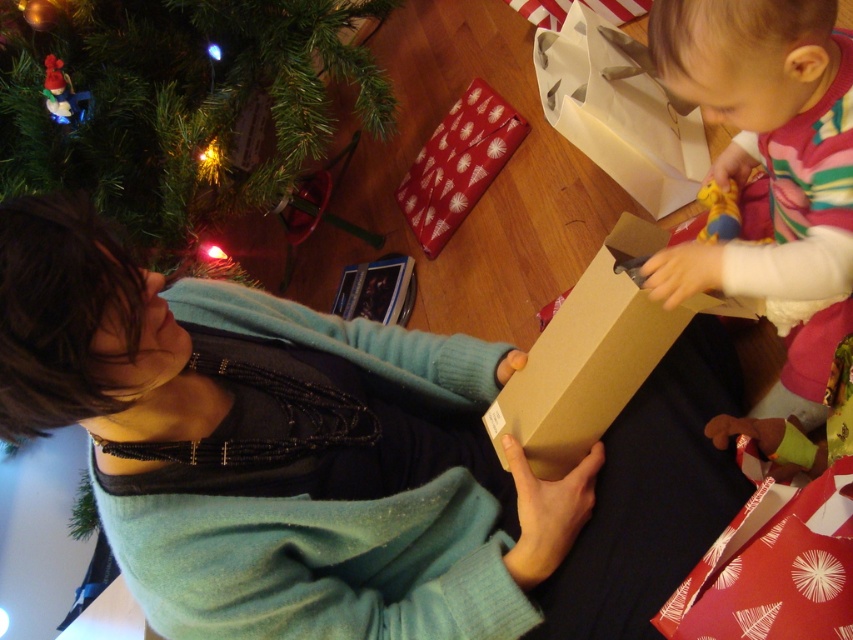
You are a guest at a holiday party and see the green matte christmas tree at upper left and the brown cardboard box at center. Which object is taller?

The green matte christmas tree at upper left is much taller than the brown cardboard box at center.

You are a guest at a holiday party and see two boxes at the center of the scene. Which box is closer to you, the matte brown box at center or the brown cardboard box at center?

The matte brown box at center is closer to you because it is in front of the brown cardboard box at center.

You are a guest at a holiday party and see the green matte christmas tree at upper left and the brown cardboard box at center. Which object takes up more space in the image?

The green matte christmas tree at upper left is bigger than the brown cardboard box at center, so it takes up more space in the image.